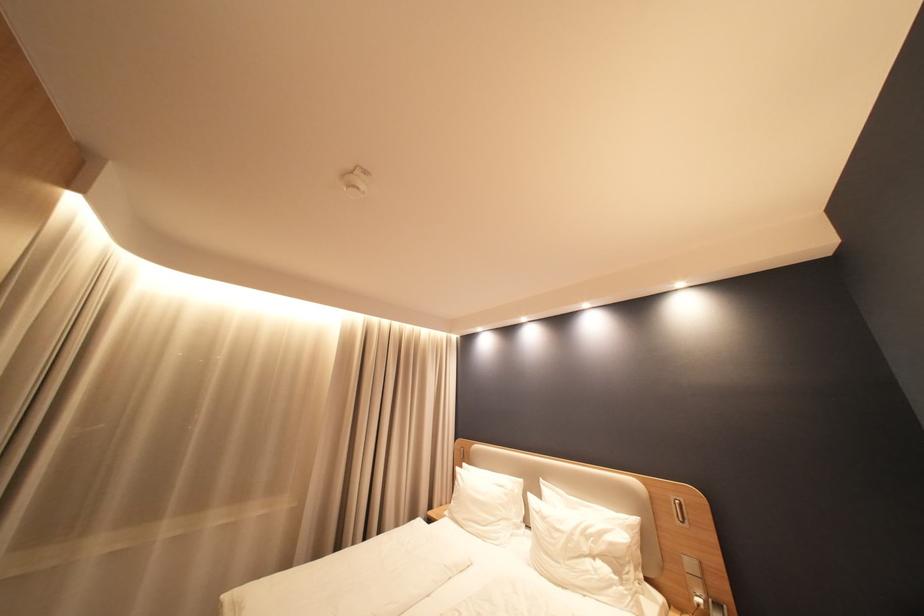
Find where to insert the recessed headboard slot. Please return your answer as a coordinate pair (x, y).

(678, 511)